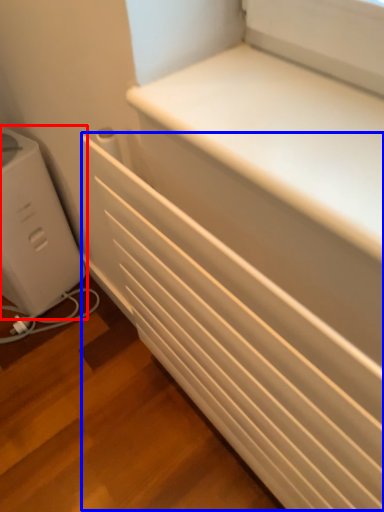
Question: Which object appears closest to the camera in this image, home appliance (highlighted by a red box) or radiator (highlighted by a blue box)?

Choices:
 (A) home appliance
 (B) radiator

Answer: (B)